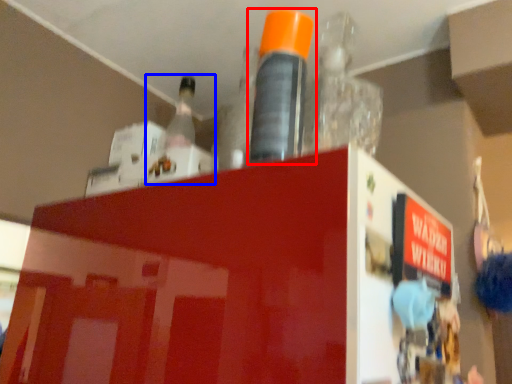
Question: Among these objects, which one is farthest to the camera, bottle (highlighted by a red box) or bottle (highlighted by a blue box)?

Choices:
 (A) bottle
 (B) bottle

Answer: (B)